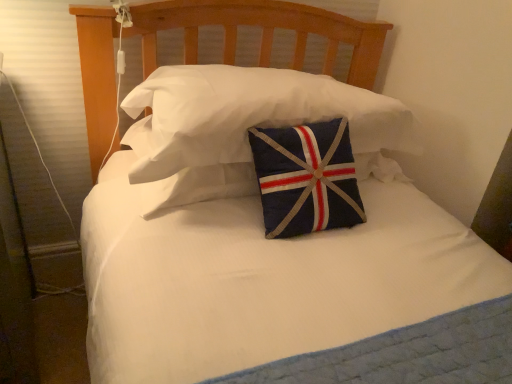
Question: Does quilted fabric pillow at center, marked as the 1th pillow in a top-to-bottom arrangement, have a greater height compared to navy blue fabric pillow at center, which is the second pillow from top to bottom?

Choices:
 (A) no
 (B) yes

Answer: (B)

Question: From the image's perspective, is quilted fabric pillow at center, which is the second pillow from bottom to top, located beneath navy blue fabric pillow at center, the 1th pillow from the bottom?

Choices:
 (A) no
 (B) yes

Answer: (A)

Question: Is the depth of quilted fabric pillow at center, marked as the 1th pillow in a top-to-bottom arrangement, greater than that of navy blue fabric pillow at center, the 1th pillow from the bottom?

Choices:
 (A) no
 (B) yes

Answer: (A)

Question: Is quilted fabric pillow at center, which is the second pillow from bottom to top, next to navy blue fabric pillow at center, the 1th pillow from the bottom?

Choices:
 (A) no
 (B) yes

Answer: (A)

Question: Does quilted fabric pillow at center, which is the second pillow from bottom to top, turn towards navy blue fabric pillow at center, which is the second pillow from top to bottom?

Choices:
 (A) no
 (B) yes

Answer: (A)

Question: Can you confirm if quilted fabric pillow at center, marked as the 1th pillow in a top-to-bottom arrangement, is thinner than navy blue fabric pillow at center, which is the second pillow from top to bottom?

Choices:
 (A) no
 (B) yes

Answer: (B)

Question: Is navy blue fabric pillow at center, the 1th pillow from the bottom, further to camera compared to quilted fabric pillow at center, which is the second pillow from bottom to top?

Choices:
 (A) no
 (B) yes

Answer: (B)

Question: Is navy blue fabric pillow at center, the 1th pillow from the bottom, smaller than quilted fabric pillow at center, which is the second pillow from bottom to top?

Choices:
 (A) yes
 (B) no

Answer: (A)

Question: Is navy blue fabric pillow at center, which is the second pillow from top to bottom, touching quilted fabric pillow at center, which is the second pillow from bottom to top?

Choices:
 (A) yes
 (B) no

Answer: (B)

Question: From the image's perspective, is navy blue fabric pillow at center, the 1th pillow from the bottom, beneath quilted fabric pillow at center, which is the second pillow from bottom to top?

Choices:
 (A) yes
 (B) no

Answer: (A)

Question: From the image's perspective, would you say navy blue fabric pillow at center, which is the second pillow from top to bottom, is positioned over quilted fabric pillow at center, which is the second pillow from bottom to top?

Choices:
 (A) yes
 (B) no

Answer: (B)

Question: Is navy blue fabric pillow at center, which is the second pillow from top to bottom, positioned with its back to quilted fabric pillow at center, which is the second pillow from bottom to top?

Choices:
 (A) no
 (B) yes

Answer: (A)

Question: From the image's perspective, is navy blue fabric pillow at center, the 1th pillow from the bottom, above or below quilted fabric pillow at center, which is the second pillow from bottom to top?

Choices:
 (A) below
 (B) above

Answer: (A)